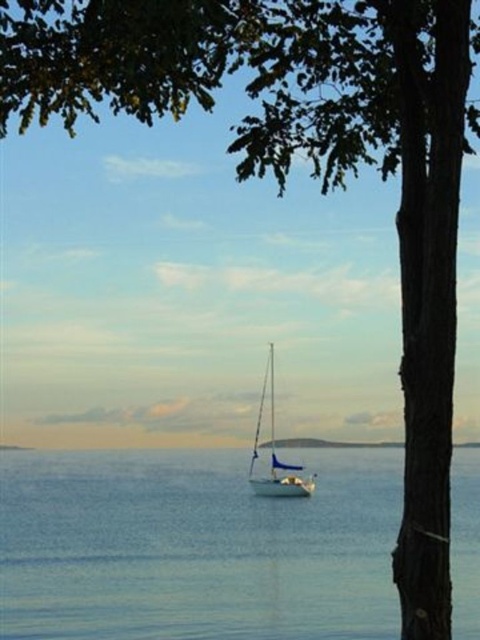
Question: Does blue water at center appear under white glossy sailboat at center?

Choices:
 (A) yes
 (B) no

Answer: (B)

Question: Does blue water at center appear on the right side of white glossy sailboat at center?

Choices:
 (A) no
 (B) yes

Answer: (B)

Question: Does blue water at center have a smaller size compared to white glossy sailboat at center?

Choices:
 (A) yes
 (B) no

Answer: (B)

Question: Among these points, which one is nearest to the camera?

Choices:
 (A) (259, 413)
 (B) (139, 621)

Answer: (B)

Question: Among these points, which one is nearest to the camera?

Choices:
 (A) (298, 492)
 (B) (226, 602)

Answer: (B)

Question: Which point is closer to the camera?

Choices:
 (A) white glossy sailboat at center
 (B) blue water at center

Answer: (B)